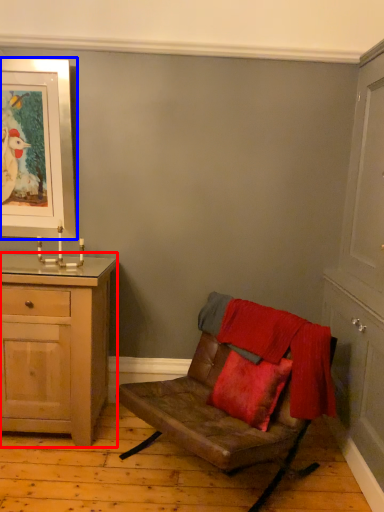
Question: Which point is closer to the camera, chest of drawers (highlighted by a red box) or picture frame (highlighted by a blue box)?

Choices:
 (A) chest of drawers
 (B) picture frame

Answer: (A)